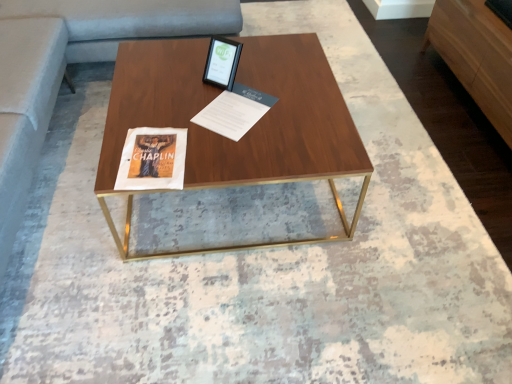
The width and height of the screenshot is (512, 384). Identify the location of free space behind white paper at center. (242, 72).